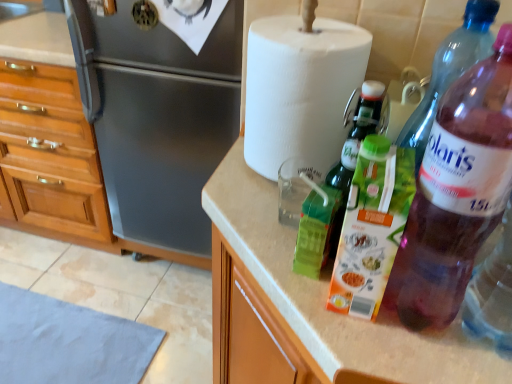
Identify the location of free space in front of green matte carton at center, which appears as the second bottle when viewed from the front. This screenshot has height=384, width=512. (369, 351).